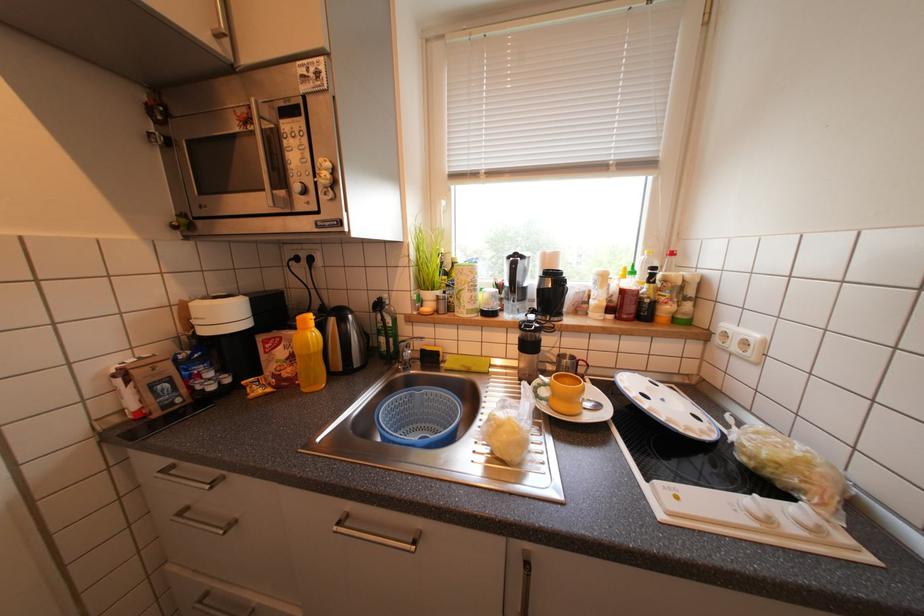
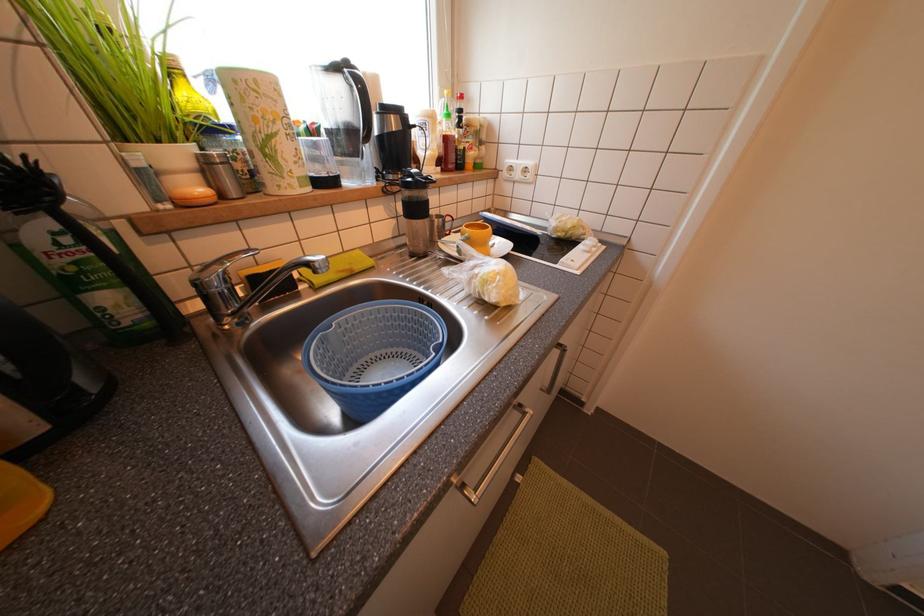
Based on the continuous images, in which direction is the camera rotating?

The camera's rotation is toward right-down.